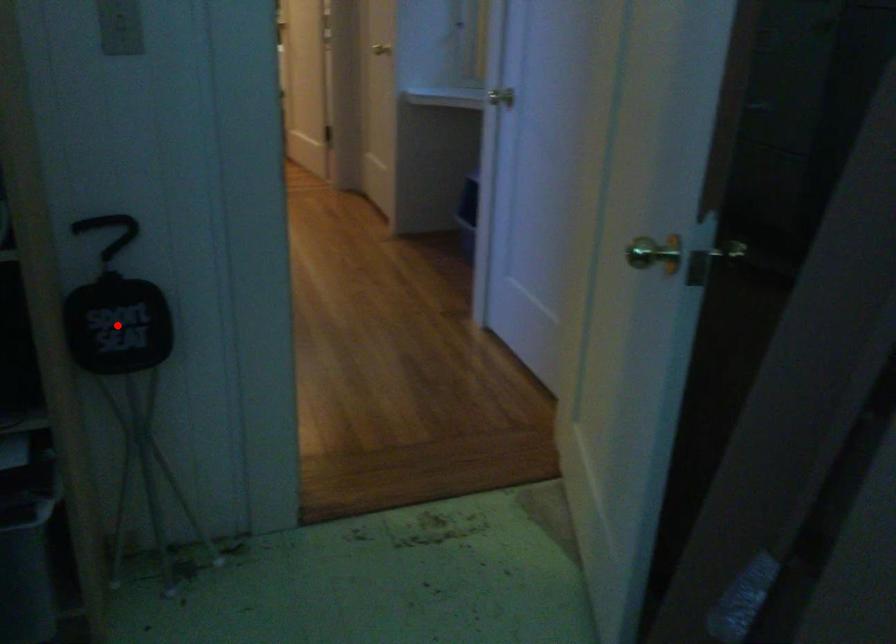
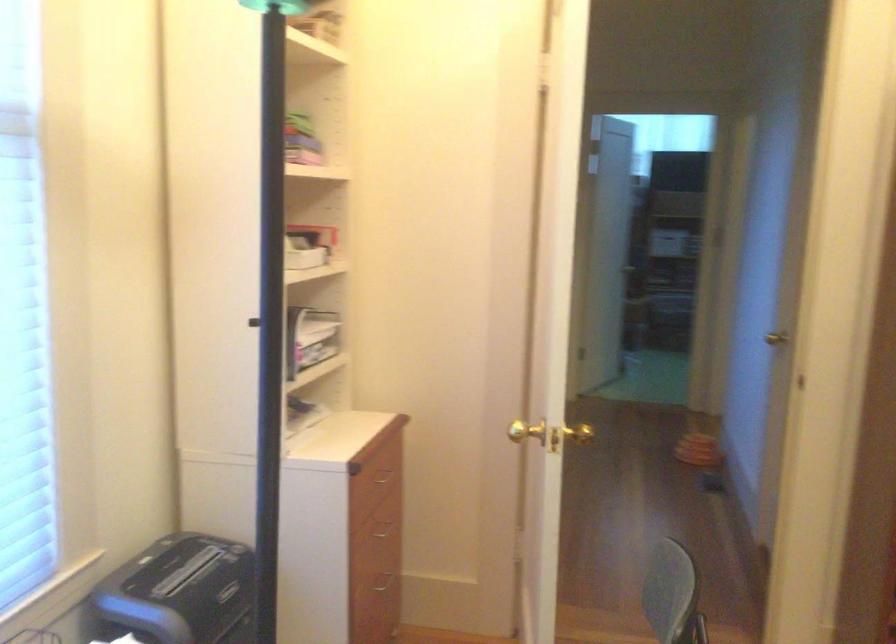
Question: I am providing you with two images of the same scene from different viewpoints. A red point is marked on the first image. Can you still see the location of the red point in image 2?

Choices:
 (A) Yes
 (B) No

Answer: (B)